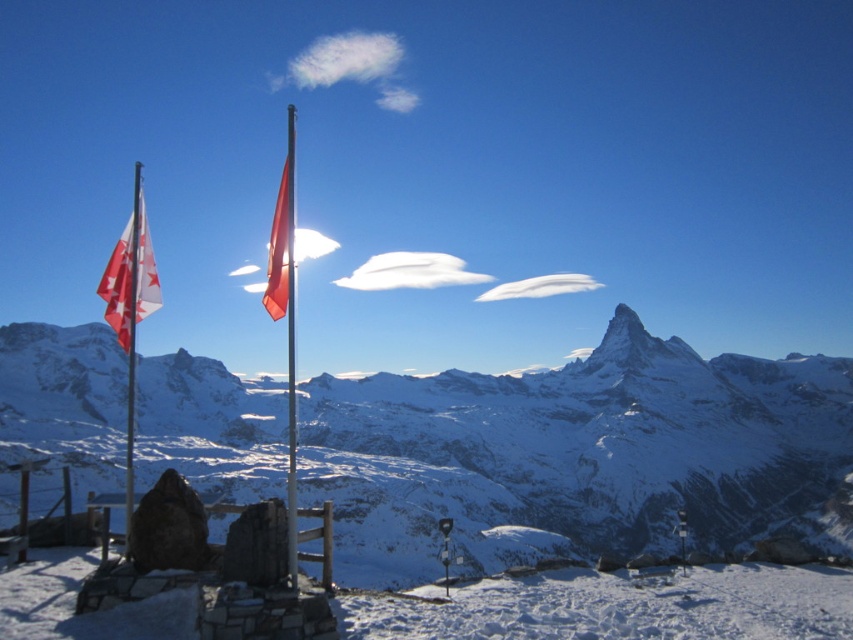
Question: Can you confirm if snowy granite mountain range at upper center is thinner than metallic silver flag pole at left?

Choices:
 (A) no
 (B) yes

Answer: (A)

Question: Estimate the real-world distances between objects in this image. Which object is closer to the red fabric flag at left?

Choices:
 (A) metallic silver flag pole at left
 (B) white snow ski slope at lower center
 (C) snowy granite mountain range at upper center

Answer: (A)

Question: Among these objects, which one is farthest from the camera?

Choices:
 (A) red fabric flag at left
 (B) white snow ski slope at lower center
 (C) snowy granite mountain range at upper center

Answer: (C)

Question: Which point is closer to the camera?

Choices:
 (A) red matte flag at center
 (B) white snow ski slope at lower center
 (C) metallic silver flag pole at left
 (D) snowy granite mountain range at upper center

Answer: (B)

Question: From the image, what is the correct spatial relationship of snowy granite mountain range at upper center in relation to white snow ski slope at lower center?

Choices:
 (A) right
 (B) left

Answer: (A)

Question: Can you confirm if white snow ski slope at lower center is positioned to the right of metallic silver flag pole at left?

Choices:
 (A) no
 (B) yes

Answer: (B)